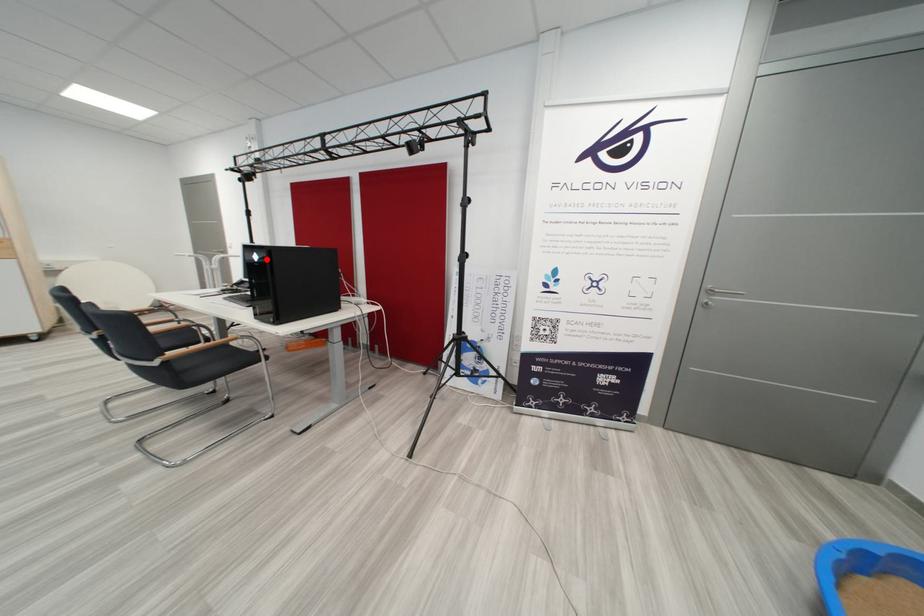
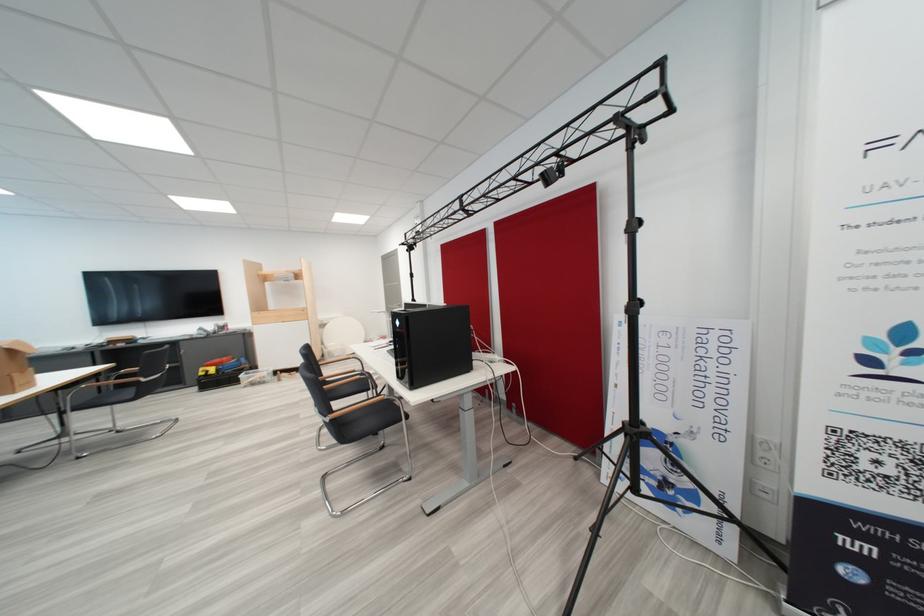
In the second image, find the point that corresponds to the highlighted location in the first image.

(407, 325)